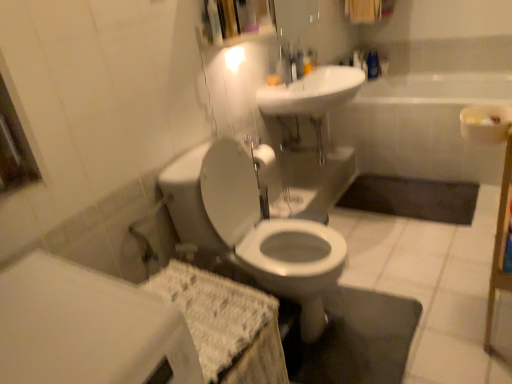
Question: Is dark gray rubber bath mat at lower center closer to the viewer compared to white glossy faucet at upper center?

Choices:
 (A) yes
 (B) no

Answer: (B)

Question: Can you confirm if dark gray rubber bath mat at lower center is shorter than white glossy faucet at upper center?

Choices:
 (A) no
 (B) yes

Answer: (B)

Question: Is dark gray rubber bath mat at lower center placed right next to white glossy faucet at upper center?

Choices:
 (A) yes
 (B) no

Answer: (B)

Question: Can you confirm if dark gray rubber bath mat at lower center is smaller than white glossy faucet at upper center?

Choices:
 (A) no
 (B) yes

Answer: (A)

Question: Would you consider dark gray rubber bath mat at lower center to be distant from white glossy faucet at upper center?

Choices:
 (A) yes
 (B) no

Answer: (A)

Question: Is dark gray rubber bath mat at lower center wider than white glossy faucet at upper center?

Choices:
 (A) no
 (B) yes

Answer: (B)

Question: From a real-world perspective, is white glossy faucet at upper center on white glossy toilet at center?

Choices:
 (A) yes
 (B) no

Answer: (A)

Question: Does white glossy faucet at upper center come in front of white glossy toilet at center?

Choices:
 (A) no
 (B) yes

Answer: (A)

Question: Would you say white glossy faucet at upper center is a long distance from white glossy toilet at center?

Choices:
 (A) yes
 (B) no

Answer: (B)

Question: Would you say white glossy faucet at upper center contains white glossy toilet at center?

Choices:
 (A) no
 (B) yes

Answer: (A)

Question: From a real-world perspective, is white glossy faucet at upper center under white glossy toilet at center?

Choices:
 (A) no
 (B) yes

Answer: (A)

Question: Does white glossy faucet at upper center have a greater height compared to white glossy toilet at center?

Choices:
 (A) yes
 (B) no

Answer: (B)

Question: Is dark gray rubber bath mat at lower center bigger than white glossy sink at upper center?

Choices:
 (A) no
 (B) yes

Answer: (A)